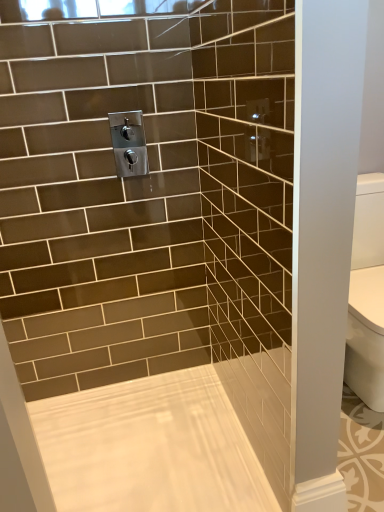
Question: Is white glossy bathtub at center in front of or behind satin nickel faucet at upper center in the image?

Choices:
 (A) behind
 (B) front

Answer: (B)

Question: Is white glossy bathtub at center to the left or to the right of satin nickel faucet at upper center in the image?

Choices:
 (A) left
 (B) right

Answer: (B)

Question: Considering the positions of white glossy bathtub at center and satin nickel faucet at upper center in the image, is white glossy bathtub at center taller or shorter than satin nickel faucet at upper center?

Choices:
 (A) tall
 (B) short

Answer: (B)

Question: Considering their positions, is satin nickel faucet at upper center located in front of or behind white glossy bathtub at center?

Choices:
 (A) front
 (B) behind

Answer: (B)

Question: Is point pyautogui.click(x=135, y=114) closer or farther from the camera than point pyautogui.click(x=72, y=404)?

Choices:
 (A) closer
 (B) farther

Answer: (A)

Question: Considering the positions of satin nickel faucet at upper center and white glossy bathtub at center in the image, is satin nickel faucet at upper center bigger or smaller than white glossy bathtub at center?

Choices:
 (A) big
 (B) small

Answer: (B)

Question: In terms of width, does satin nickel faucet at upper center look wider or thinner when compared to white glossy bathtub at center?

Choices:
 (A) wide
 (B) thin

Answer: (B)